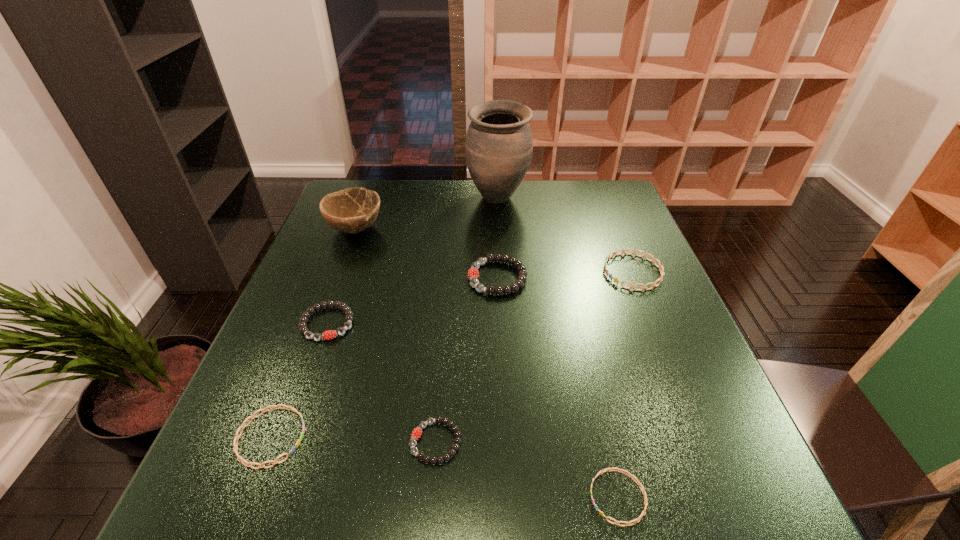
The height and width of the screenshot is (540, 960). Identify the location of object at the far left corner. (352, 210).

Find the location of a particular element. free location at the far edge is located at coordinates (414, 186).

Image resolution: width=960 pixels, height=540 pixels. In the image, there is a desktop. What are the coordinates of `vacant space at the near edge` in the screenshot? It's located at [608, 515].

In the image, there is a desktop. Identify the location of free region at the left edge. (249, 387).

At what (x,y) coordinates should I click in order to perform the action: click on free space at the right edge. Please return your answer as a coordinate pair (x, y). The image size is (960, 540). Looking at the image, I should click on (713, 394).

Identify the location of blank area at the near right corner. (771, 504).

Locate an element on the screen. This screenshot has width=960, height=540. vacant area that lies between the third farthest bracelet and the second smallest blue bracelet is located at coordinates (300, 380).

At what (x,y) coordinates should I click in order to perform the action: click on vacant area that lies between the biggest black bracelet and the second black bracelet from right to left. Please return your answer as a coordinate pair (x, y). This screenshot has width=960, height=540. Looking at the image, I should click on (467, 360).

At what (x,y) coordinates should I click in order to perform the action: click on free area in between the second object from right to left and the farthest blue bracelet. Please return your answer as a coordinate pair (x, y). The width and height of the screenshot is (960, 540). Looking at the image, I should click on (625, 384).

At what (x,y) coordinates should I click in order to perform the action: click on vacant space in between the tallest object and the shortest bracelet. Please return your answer as a coordinate pair (x, y). Looking at the image, I should click on point(558,348).